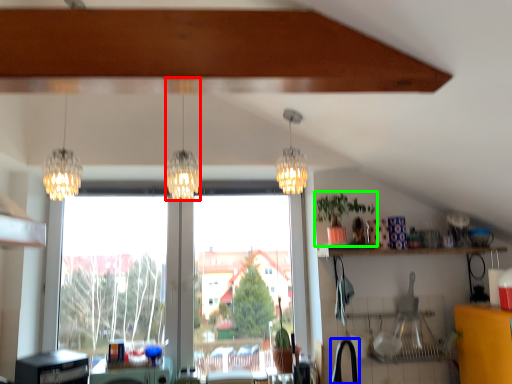
Question: Which object is the farthest from lamp (highlighted by a red box)? Choose among these: faucet (highlighted by a blue box) or houseplant (highlighted by a green box).

Choices:
 (A) faucet
 (B) houseplant

Answer: (A)